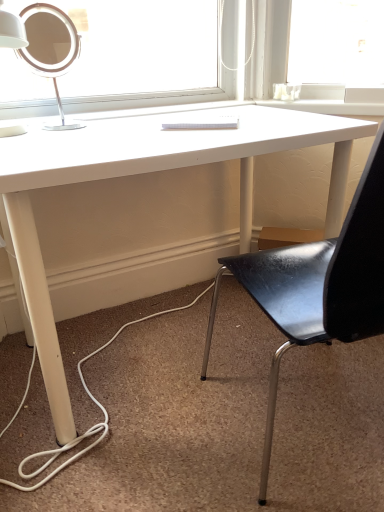
The image size is (384, 512). Describe the element at coordinates (319, 284) in the screenshot. I see `black leather chair at center` at that location.

Locate an element on the screen. The image size is (384, 512). matte white lamp at upper left is located at coordinates (50, 48).

Considering the positions of point (132, 131) and point (59, 67), is point (132, 131) closer or farther from the camera than point (59, 67)?

Point (132, 131).

From the picture: Is white matte desk at center placed right next to matte white lamp at upper left?

There is a gap between white matte desk at center and matte white lamp at upper left.

Locate an element on the screen. Image resolution: width=384 pixels, height=512 pixels. desk that is below the matte white lamp at upper left (from the image's perspective) is located at coordinates (147, 172).

From a real-world perspective, which object rests below the other?

From a 3D spatial view, white matte desk at center is below.

How far apart are black leather chair at center and matte white lamp at upper left?

black leather chair at center is 79.24 centimeters from matte white lamp at upper left.

Does black leather chair at center have a lesser width compared to matte white lamp at upper left?

No, black leather chair at center is not thinner than matte white lamp at upper left.

From the picture: Considering the relative sizes of black leather chair at center and matte white lamp at upper left in the image provided, is black leather chair at center bigger than matte white lamp at upper left?

Yes.

From a real-world perspective, is black leather chair at center over matte white lamp at upper left?

No, from a real-world perspective, black leather chair at center is not over matte white lamp at upper left

What's the angular difference between black leather chair at center and white matte desk at center's facing directions?

black leather chair at center and white matte desk at center are facing 179 degrees away from each other.

Locate an element on the screen. The image size is (384, 512). desk behind the black leather chair at center is located at coordinates (147, 172).

How much distance is there between black leather chair at center and white matte desk at center?

black leather chair at center is 16.75 inches away from white matte desk at center.

From the image's perspective, is black leather chair at center below white matte desk at center?

Yes.

Is matte white lamp at upper left inside the boundaries of white matte desk at center, or outside?

The correct answer is: outside.

Does matte white lamp at upper left come in front of white matte desk at center?

No, matte white lamp at upper left is further to the viewer.

Is matte white lamp at upper left oriented towards white matte desk at center?

No, matte white lamp at upper left is not aimed at white matte desk at center.

From a real-world perspective, between matte white lamp at upper left and white matte desk at center, who is vertically higher?

From a 3D spatial view, matte white lamp at upper left is above.

Is black leather chair at center at the back of matte white lamp at upper left?

matte white lamp at upper left does not have its back to black leather chair at center.

I want to click on chair in front of the matte white lamp at upper left, so click(319, 284).

Consider the image. From a real-world perspective, is matte white lamp at upper left physically above black leather chair at center?

Indeed, from a real-world perspective, matte white lamp at upper left stands above black leather chair at center.

Do you think matte white lamp at upper left is within black leather chair at center, or outside of it?

matte white lamp at upper left is located beyond the bounds of black leather chair at center.

From the image's perspective, is white matte desk at center positioned above or below black leather chair at center?

From the image's perspective, white matte desk at center appears above black leather chair at center.

Is white matte desk at center looking in the opposite direction of black leather chair at center?

No, white matte desk at center's orientation is not away from black leather chair at center.

Is black leather chair at center completely or partially inside white matte desk at center?

No, white matte desk at center does not contain black leather chair at center.

Is there a large distance between white matte desk at center and black leather chair at center?

Actually, white matte desk at center and black leather chair at center are a little close together.

Identify the location of table lamp above the white matte desk at center (from the image's perspective). (50, 48).

Identify the location of chair that appears on the right of matte white lamp at upper left. (319, 284).

Based on their spatial positions, is matte white lamp at upper left or black leather chair at center further from white matte desk at center?

black leather chair at center lies further to white matte desk at center than the other object.

Considering their positions, is white matte desk at center positioned further to black leather chair at center than matte white lamp at upper left?

matte white lamp at upper left lies further to black leather chair at center than the other object.

Estimate the real-world distances between objects in this image. Which object is further from matte white lamp at upper left, black leather chair at center or white matte desk at center?

black leather chair at center.

Estimate the real-world distances between objects in this image. Which object is further from white matte desk at center, black leather chair at center or matte white lamp at upper left?

black leather chair at center is further to white matte desk at center.

From the image, which object appears to be nearer to black leather chair at center, matte white lamp at upper left or white matte desk at center?

Among the two, white matte desk at center is located nearer to black leather chair at center.

Considering their positions, is white matte desk at center positioned closer to matte white lamp at upper left than black leather chair at center?

white matte desk at center.

Where is `desk located between matte white lamp at upper left and black leather chair at center in the left-right direction`? The height and width of the screenshot is (512, 384). desk located between matte white lamp at upper left and black leather chair at center in the left-right direction is located at coordinates coord(147,172).